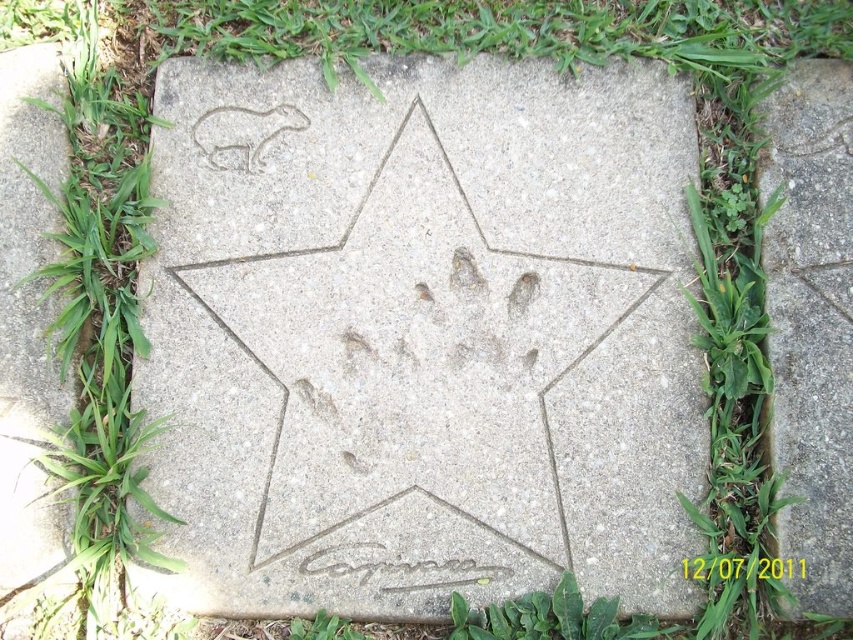
You are a gardener looking at the concrete paving stone with the star design. You notice the green leafy grass at upper left and the white stone carving at upper left. Which one is positioned lower in the scene?

The green leafy grass at upper left is positioned below the white stone carving at upper left, so the green leafy grass at upper left is lower.

You are a gardener who wants to plant a new flower bed between the green leafy grass at upper left and the white stone carving at upper left. The flower bed requires a minimum of 12 inches of space. Can you fit the flower bed between them?

The green leafy grass at upper left is 12.75 inches away from the white stone carving at upper left. Since the required space is 12 inches, the flower bed can be placed between them as the distance is sufficient.

You are a gardener who needs to place a 5 feet long hose between the concrete paving stone with a star and the green leafy grass at upper left. Can the hose reach both objects without bending?

The distance between the concrete paving stone with a star and the green leafy grass at upper left is 4.92 feet, so yes, the 5 feet long hose can easily reach both objects without bending.